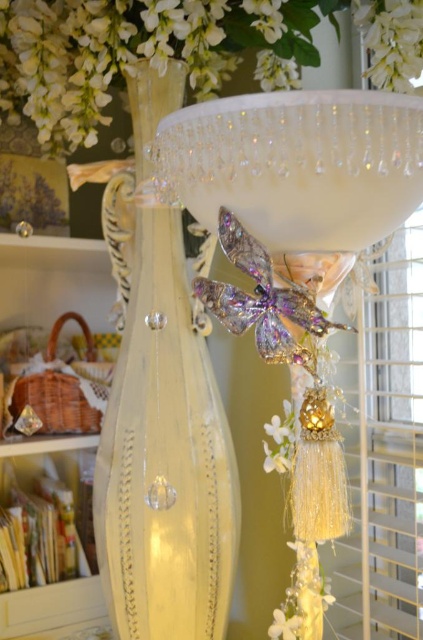
What is the object located at the coordinates point (297, 164)?

The object at point (297, 164) is the clear crystal bowl at upper center.

You are an interior designer arranging items on a shelf. You have a translucent glass bowl at upper center and a white matte flower at upper center. Which object should you place to the right to maintain symmetry?

To maintain symmetry, you should place the white matte flower at upper center to the right since the translucent glass bowl at upper center is already positioned to its left.